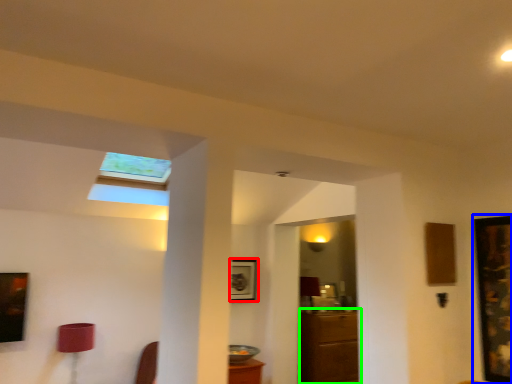
Question: Considering the real-world distances, which object is closest to picture frame (highlighted by a red box)? picture frame (highlighted by a blue box) or furniture (highlighted by a green box).

Choices:
 (A) picture frame
 (B) furniture

Answer: (B)